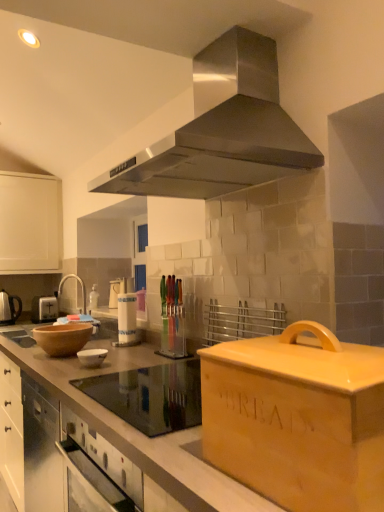
Question: From a real-world perspective, is brown wooden mixing bowl at left located higher than white plastic toaster at left?

Choices:
 (A) yes
 (B) no

Answer: (B)

Question: Is brown wooden mixing bowl at left next to white plastic toaster at left and touching it?

Choices:
 (A) yes
 (B) no

Answer: (B)

Question: Does brown wooden mixing bowl at left turn towards white plastic toaster at left?

Choices:
 (A) yes
 (B) no

Answer: (B)

Question: Would you consider brown wooden mixing bowl at left to be distant from white plastic toaster at left?

Choices:
 (A) yes
 (B) no

Answer: (A)

Question: Does brown wooden mixing bowl at left have a greater height compared to white plastic toaster at left?

Choices:
 (A) yes
 (B) no

Answer: (B)

Question: Considering the positions of white glossy bowl at center and matte brown countertop at center, which ranks as the second countertop in back-to-front order, in the image, is white glossy bowl at center taller or shorter than matte brown countertop at center, which ranks as the second countertop in back-to-front order,?

Choices:
 (A) tall
 (B) short

Answer: (B)

Question: Relative to matte brown countertop at center, which ranks as the second countertop in back-to-front order, is white glossy bowl at center in front or behind?

Choices:
 (A) front
 (B) behind

Answer: (B)

Question: Considering the relative positions of white glossy bowl at center and matte brown countertop at center, which ranks as the second countertop in back-to-front order, in the image provided, is white glossy bowl at center to the left or to the right of matte brown countertop at center, which ranks as the second countertop in back-to-front order,?

Choices:
 (A) left
 (B) right

Answer: (A)

Question: Is point 104,350 positioned closer to the camera than point 226,417?

Choices:
 (A) closer
 (B) farther

Answer: (B)

Question: Which is correct: white plastic toaster at left is inside white glossy sink at left, or outside of it?

Choices:
 (A) outside
 (B) inside

Answer: (A)

Question: In the image, is white plastic toaster at left on the left side or the right side of white glossy sink at left?

Choices:
 (A) left
 (B) right

Answer: (A)

Question: From the image's perspective, is white plastic toaster at left above or below white glossy sink at left?

Choices:
 (A) below
 (B) above

Answer: (A)

Question: Considering the positions of point coord(34,311) and point coord(79,317), is point coord(34,311) closer or farther from the camera than point coord(79,317)?

Choices:
 (A) farther
 (B) closer

Answer: (A)

Question: In the image, is white glossy sink at left on the left side or the right side of white glossy bowl at center?

Choices:
 (A) right
 (B) left

Answer: (B)

Question: Considering the positions of white glossy sink at left and white glossy bowl at center in the image, is white glossy sink at left taller or shorter than white glossy bowl at center?

Choices:
 (A) tall
 (B) short

Answer: (A)